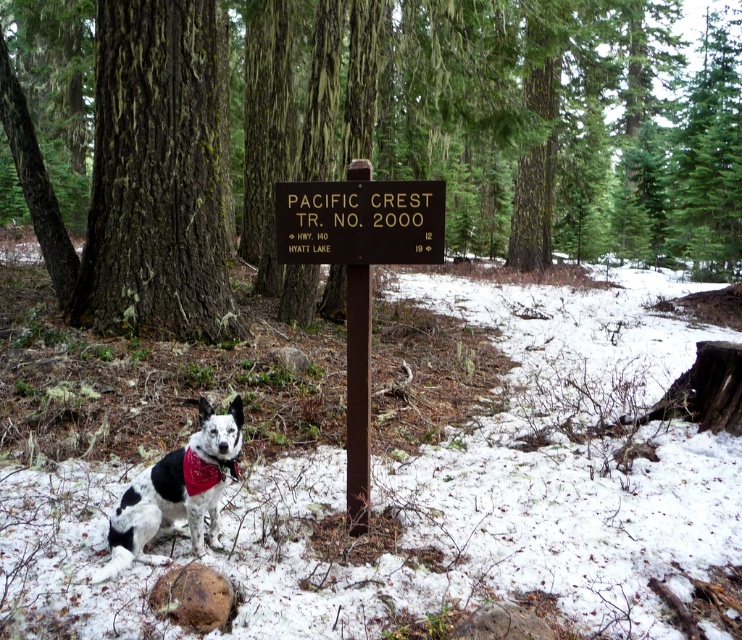
Question: Which point is farther to the camera?

Choices:
 (A) (85, 268)
 (B) (229, 472)
 (C) (499, 17)

Answer: (C)

Question: Which of these objects is positioned farthest from the smooth bark tree at center?

Choices:
 (A) brown wooden sign at center
 (B) brown rough bark tree at center

Answer: (B)

Question: Which of these objects is positioned farthest from the brown wooden sign at center?

Choices:
 (A) smooth bark tree at center
 (B) spotted fur dog at lower left

Answer: (A)

Question: Does smooth bark tree at center have a smaller size compared to spotted fur dog at lower left?

Choices:
 (A) no
 (B) yes

Answer: (A)

Question: Is the position of brown rough bark tree at center more distant than that of smooth bark tree at center?

Choices:
 (A) no
 (B) yes

Answer: (B)

Question: Where is brown rough bark tree at center located in relation to smooth bark tree at center in the image?

Choices:
 (A) right
 (B) left

Answer: (A)